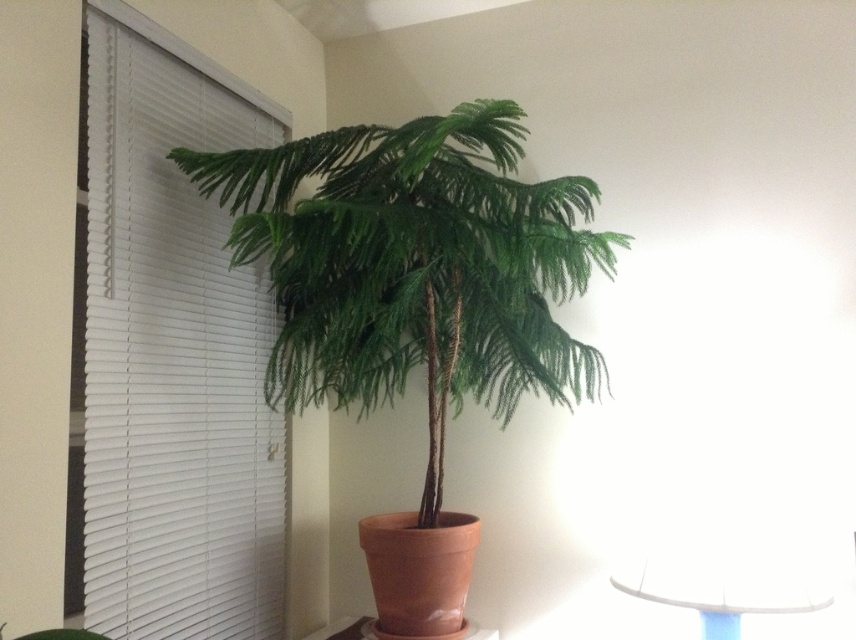
You are taking a photo of the potted Norfolk Island Pine tree and need to focus on two points in the scene. The first point is at coordinates point (334, 388), and the second is at point (744, 589). Which point should you focus on first if you want to ensure both are in focus?

You should focus on point (334, 388) first because it is closer to the camera than point (744, 589). By focusing on the closer point, the farther point may also fall within the depth of field, ensuring both are in focus.

You are a photographer trying to capture the white blinds at left in focus while also wanting the Norfolk Island Pine tree to be visible in the background. If your camera has a depth of field that can sharply focus objects within 1.5 meters from the lens, will the Norfolk Island Pine tree be in focus?

The white blinds at left are 1.42 meters away from the camera, so if the Norfolk Island Pine tree is further away than 1.5 meters, it might be out of focus. However, the exact distance of the tree isn t provided, so we can t confirm.